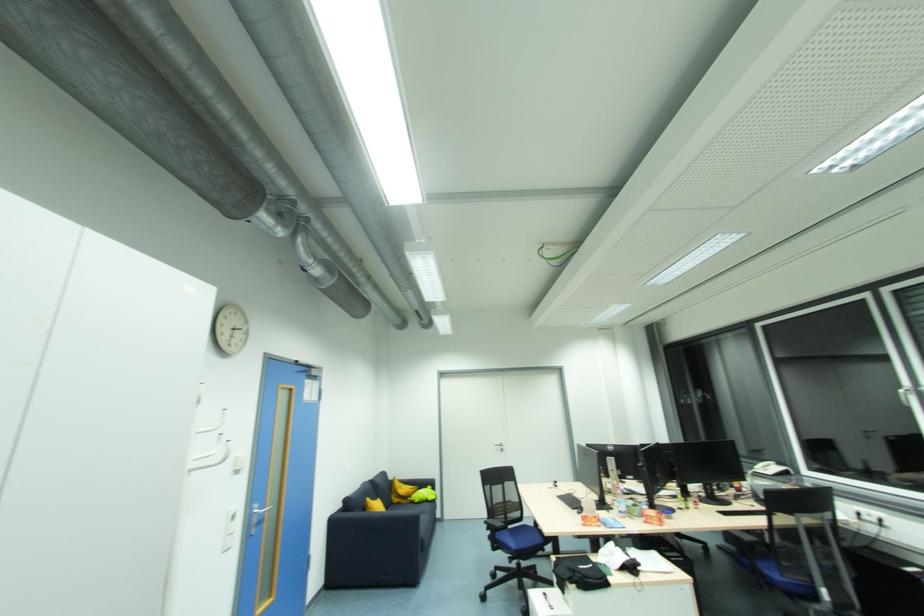
What are the coordinates of `white window handle` in the screenshot? It's located at (906, 397).